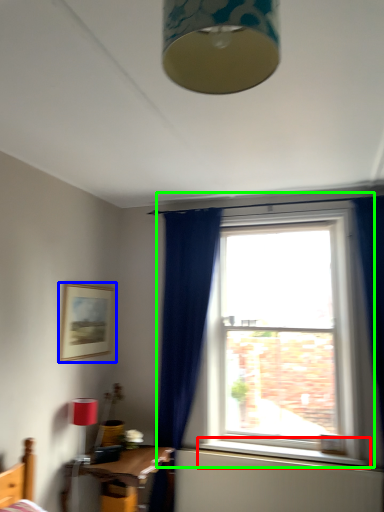
Question: Which is nearer to the window sill (highlighted by a red box)? picture frame (highlighted by a blue box) or window (highlighted by a green box).

Choices:
 (A) picture frame
 (B) window

Answer: (B)